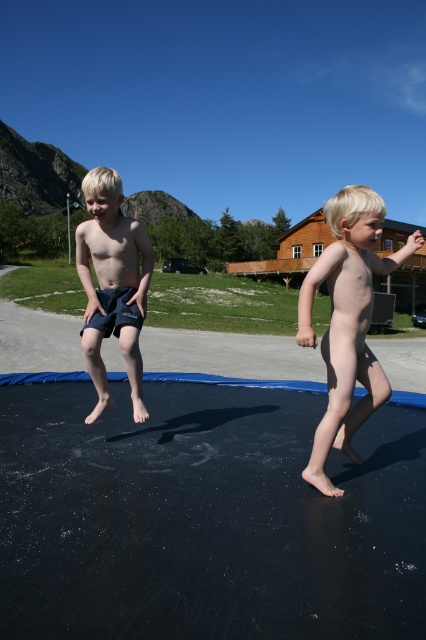
You are a photographer trying to capture a photo of the nude skin at center and the dark blue shorts at left. Which object should you focus on if you want to capture the wider one in your shot?

The nude skin at center is wider than the dark blue shorts at left, so you should focus on the nude skin at center to capture the wider object in your shot.

You are a photographer trying to capture both the nude skin at center and the dark blue shorts at left in a single shot. Based on their positions, will you need to adjust your camera angle to include both?

The nude skin at center is to the right of the dark blue shorts at left, so you will need to adjust your camera angle to ensure both are included in the frame.

Looking at this image, you are standing at the point with coordinates point (106, 381) and want to walk to the point with coordinates point (362, 412). Which direction should you move relative to the wooden building with a brown exterior and a red roof?

You should move towards the wooden building with a brown exterior and a red roof because point (362, 412) is in front of point (106, 381) relative to the building.